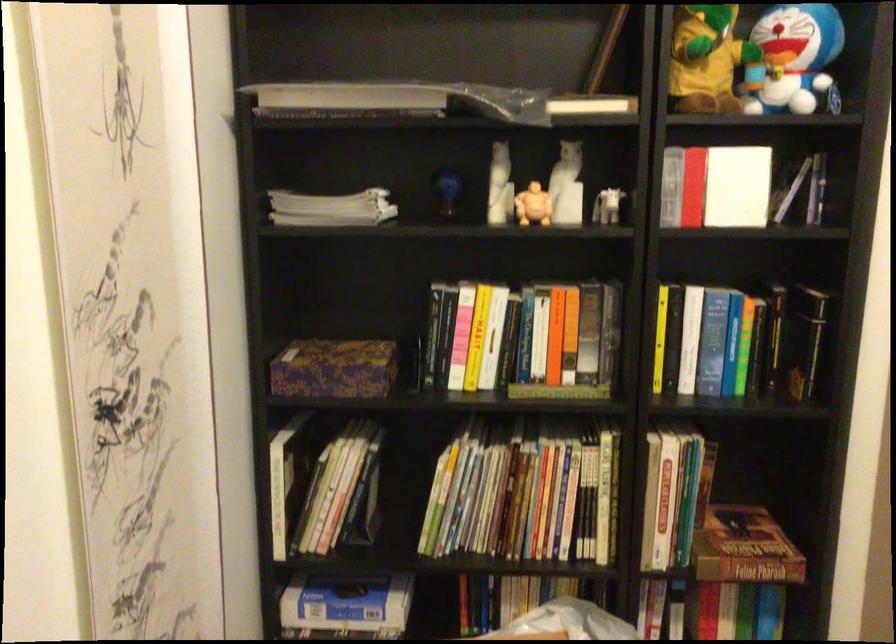
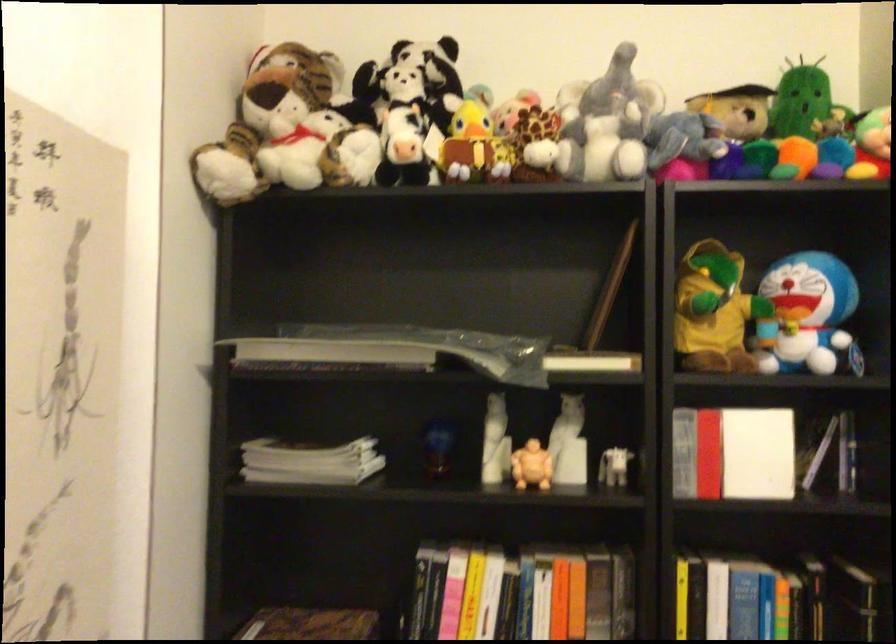
Find the pixel in the second image that matches point (493, 323) in the first image.

(485, 599)